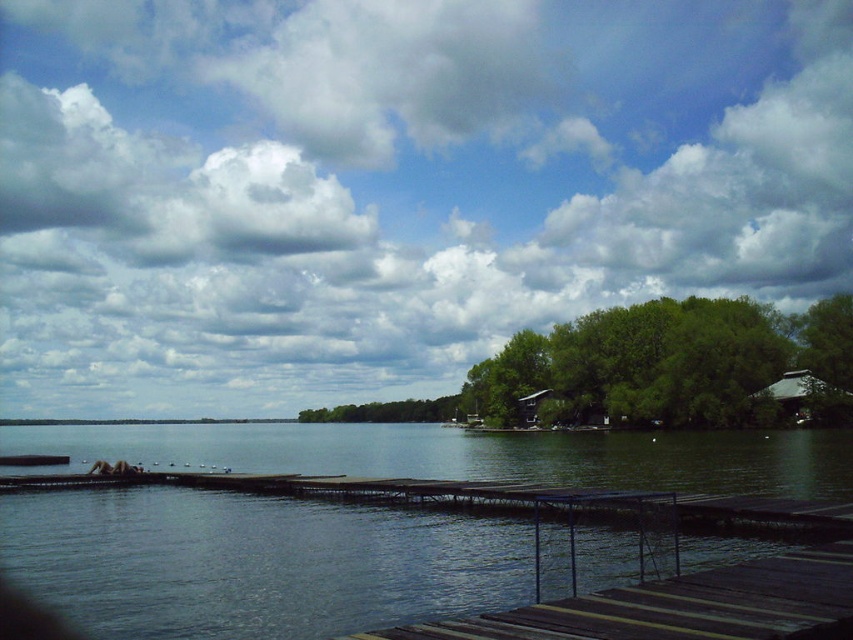
You are standing at the point with coordinates point (695, 588) and want to walk towards the point with coordinates point (795, 401). Which direction should you move?

You should move towards the point (795, 401), which is behind point (695, 588) according to the scene description.

You are standing on the wooden dock and want to check the water quality. Which object, the transparent water at center or the wooden planks at center, is positioned to the left when facing the water?

The transparent water at center is to the left of wooden planks at center, so when facing the water, the transparent water at center is positioned to the left.

You are standing at the lakeside and want to take a photo of the green leafy trees at center. If your camera has a maximum zoom range of 50 meters, will you be able to capture the trees clearly in the photo?

The green leafy trees at center is 68.17 meters from viewer. Since the camera can only zoom up to 50 meters, you won not be able to capture the trees clearly.